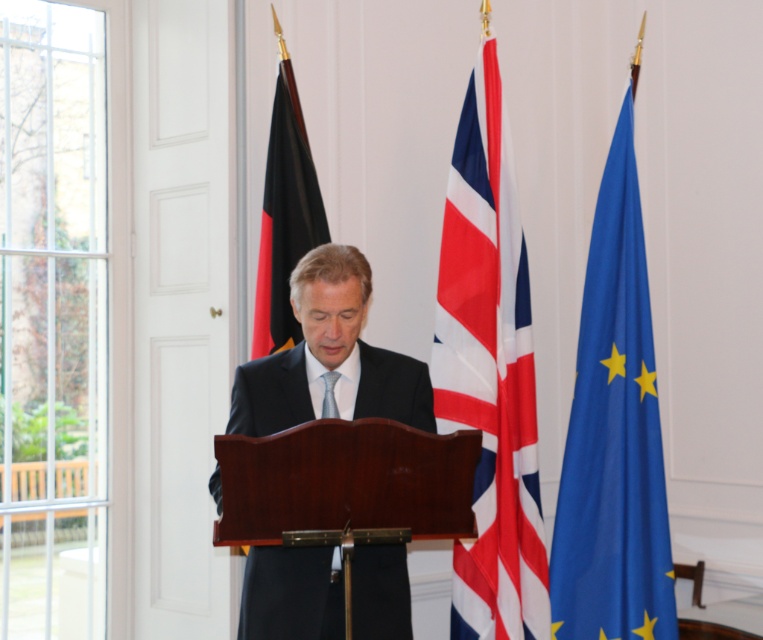
Does blue fabric flag at right appear on the left side of black fabric flag at left?

Incorrect, blue fabric flag at right is not on the left side of black fabric flag at left.

Is blue fabric flag at right shorter than black fabric flag at left?

No.

Who is more distant from viewer, [623,227] or [311,163]?

Positioned behind is point [623,227].

Where is `blue fabric flag at right`? Image resolution: width=763 pixels, height=640 pixels. blue fabric flag at right is located at coordinates (613, 435).

What do you see at coordinates (488, 372) in the screenshot? Image resolution: width=763 pixels, height=640 pixels. I see `red-white-blue fabric flag at center` at bounding box center [488, 372].

Where is `red-white-blue fabric flag at center`? The height and width of the screenshot is (640, 763). red-white-blue fabric flag at center is located at coordinates (488, 372).

Locate an element on the screen. The height and width of the screenshot is (640, 763). red-white-blue fabric flag at center is located at coordinates (488, 372).

Between point (662, 589) and point (324, 388), which one is positioned in front?

Point (324, 388) is in front.

Can you confirm if blue fabric flag at right is thinner than silky blue tie at center?

In fact, blue fabric flag at right might be wider than silky blue tie at center.

What do you see at coordinates (613, 435) in the screenshot?
I see `blue fabric flag at right` at bounding box center [613, 435].

I want to click on blue fabric flag at right, so click(x=613, y=435).